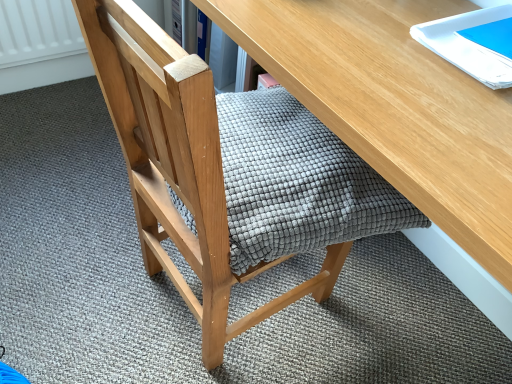
Question: Can you confirm if white glossy notebook at upper right is thinner than wooden desk at center?

Choices:
 (A) yes
 (B) no

Answer: (A)

Question: Are white glossy notebook at upper right and wooden desk at center beside each other?

Choices:
 (A) yes
 (B) no

Answer: (B)

Question: Does white glossy notebook at upper right have a greater height compared to wooden desk at center?

Choices:
 (A) no
 (B) yes

Answer: (A)

Question: Does white glossy notebook at upper right have a lesser height compared to wooden desk at center?

Choices:
 (A) no
 (B) yes

Answer: (B)

Question: From the image's perspective, is white glossy notebook at upper right beneath wooden desk at center?

Choices:
 (A) yes
 (B) no

Answer: (B)

Question: From a real-world perspective, is white glossy notebook at upper right physically located above or below textured gray cushion at center?

Choices:
 (A) below
 (B) above

Answer: (B)

Question: From the image's perspective, relative to textured gray cushion at center, is white glossy notebook at upper right above or below?

Choices:
 (A) above
 (B) below

Answer: (A)

Question: Considering their positions, is white glossy notebook at upper right located in front of or behind textured gray cushion at center?

Choices:
 (A) front
 (B) behind

Answer: (B)

Question: Choose the correct answer: Is white glossy notebook at upper right inside textured gray cushion at center or outside it?

Choices:
 (A) outside
 (B) inside

Answer: (A)

Question: Do you think white glossy notebook at upper right is within wooden desk at center, or outside of it?

Choices:
 (A) inside
 (B) outside

Answer: (B)

Question: In terms of size, does white glossy notebook at upper right appear bigger or smaller than wooden desk at center?

Choices:
 (A) big
 (B) small

Answer: (B)

Question: Is white glossy notebook at upper right wider or thinner than wooden desk at center?

Choices:
 (A) thin
 (B) wide

Answer: (A)

Question: In terms of height, does white glossy notebook at upper right look taller or shorter compared to wooden desk at center?

Choices:
 (A) tall
 (B) short

Answer: (B)

Question: Is point (148, 155) positioned closer to the camera than point (479, 134)?

Choices:
 (A) farther
 (B) closer

Answer: (A)

Question: Based on their sizes in the image, would you say textured gray cushion at center is bigger or smaller than wooden desk at center?

Choices:
 (A) big
 (B) small

Answer: (B)